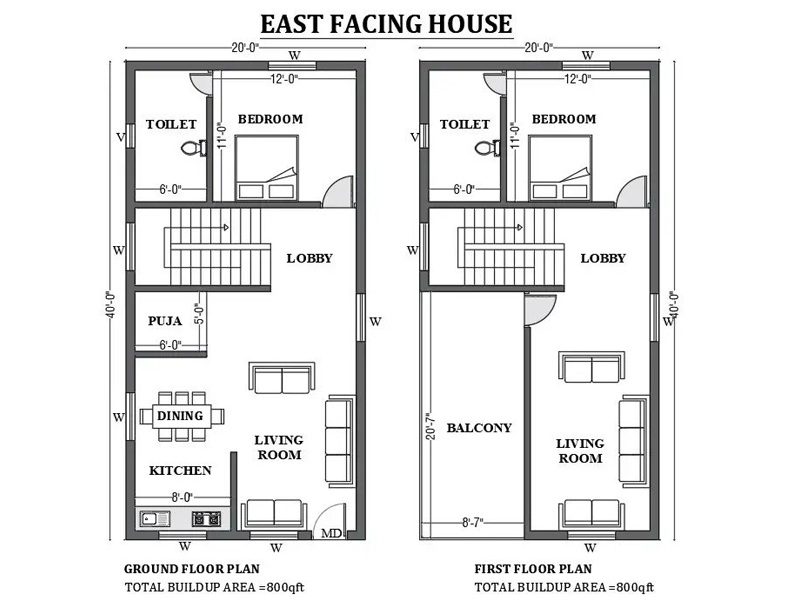
The width and height of the screenshot is (800, 600). I want to click on sink, so tap(158, 514).